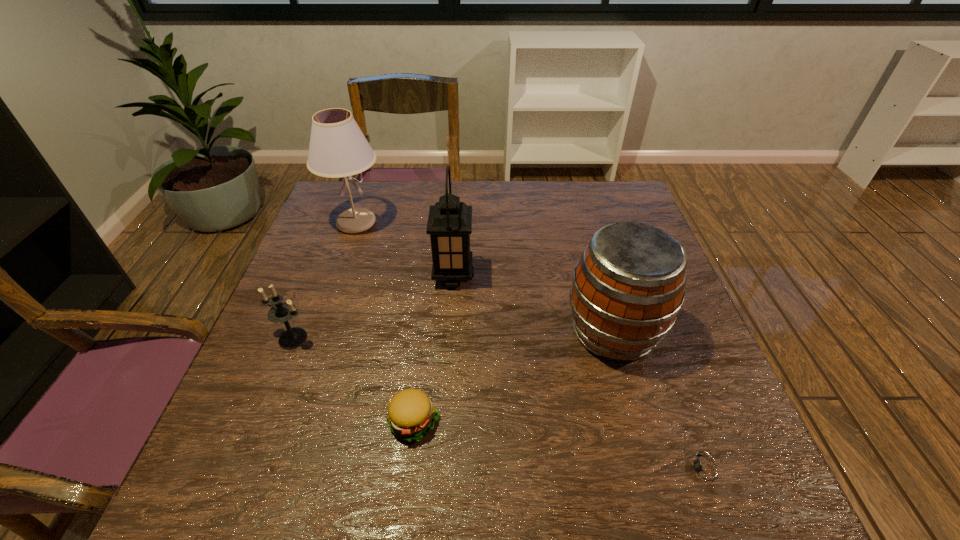
Identify the location of object that is at the far left corner. (338, 148).

Locate an element on the screen. Image resolution: width=960 pixels, height=540 pixels. object present at the near right corner is located at coordinates (705, 470).

Identify the location of vacant area at the far edge. (401, 184).

The width and height of the screenshot is (960, 540). What are the coordinates of `vacant region at the near edge` in the screenshot? It's located at (405, 504).

Locate an element on the screen. Image resolution: width=960 pixels, height=540 pixels. free region at the left edge of the desktop is located at coordinates (304, 296).

The height and width of the screenshot is (540, 960). I want to click on blank space at the right edge of the desktop, so (x=712, y=444).

Locate an element on the screen. Image resolution: width=960 pixels, height=540 pixels. vacant space at the far left corner of the desktop is located at coordinates (375, 186).

Image resolution: width=960 pixels, height=540 pixels. I want to click on vacant space at the near right corner of the desktop, so click(746, 487).

Locate an element on the screen. The height and width of the screenshot is (540, 960). empty space that is in between the fourth shortest object and the fifth tallest object is located at coordinates (514, 376).

The image size is (960, 540). What are the coordinates of `free space between the fourth shortest object and the lampshade` in the screenshot? It's located at point(485,277).